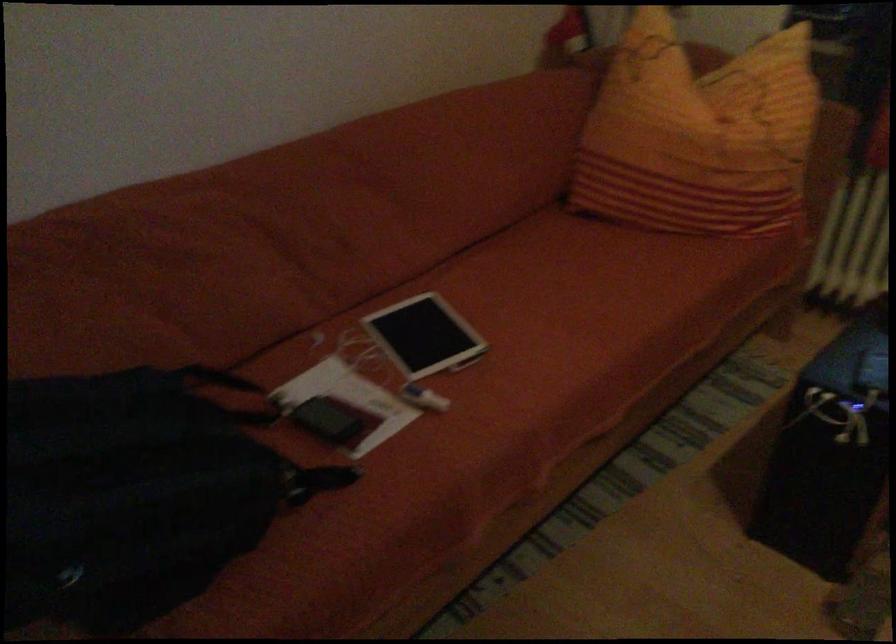
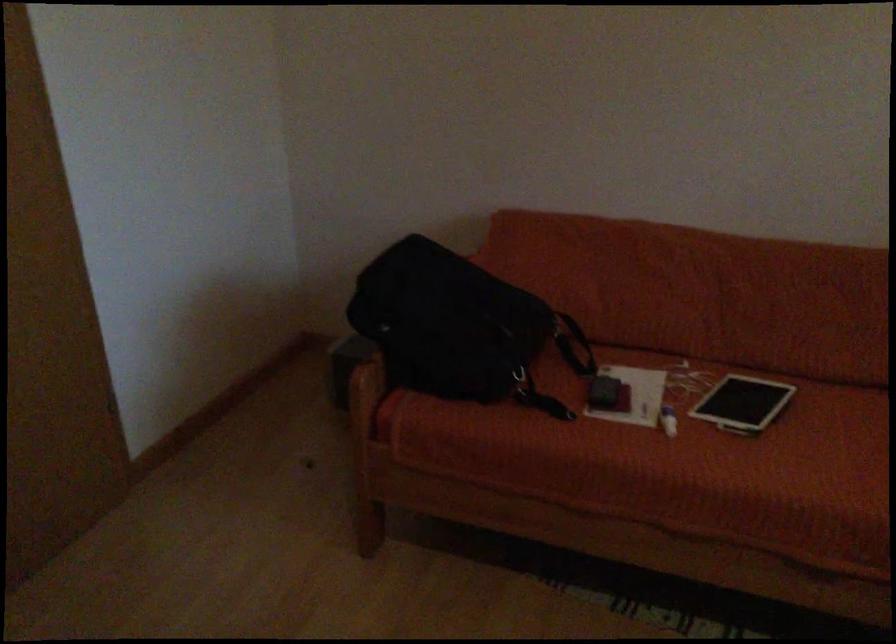
In the second image, find the point that corresponds to pixel 183 388 in the first image.

(567, 332)